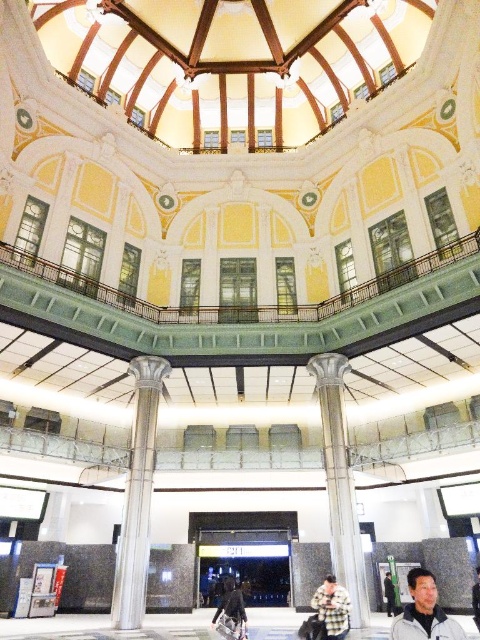
Question: Can you confirm if polished silver column at center is positioned to the left of dark gray fabric jacket at lower center?

Choices:
 (A) no
 (B) yes

Answer: (A)

Question: Which of these objects is positioned closest to the fluffy beige coat at center?

Choices:
 (A) gray fabric jacket at lower right
 (B) dark gray fabric jacket at lower center

Answer: (B)

Question: Where is polished silver column at center located in relation to dark gray fabric jacket at lower center in the image?

Choices:
 (A) above
 (B) below

Answer: (A)

Question: Can you confirm if polished silver column at center is positioned to the left of dark gray fabric jacket at lower center?

Choices:
 (A) yes
 (B) no

Answer: (B)

Question: Which point appears closest to the camera in this image?

Choices:
 (A) [x=446, y=627]
 (B) [x=337, y=419]

Answer: (A)

Question: Which of the following is the closest to the observer?

Choices:
 (A) pos(147,392)
 (B) pos(224,602)

Answer: (B)